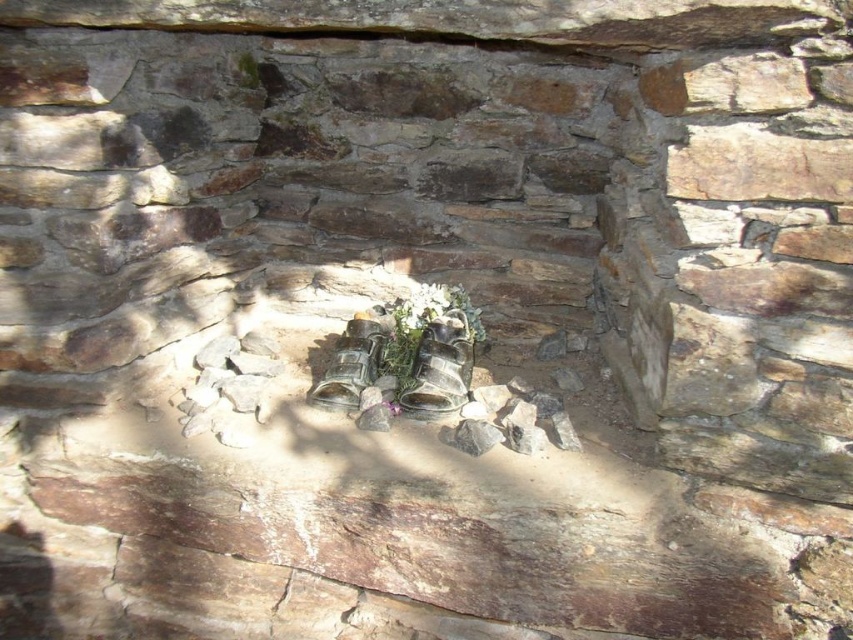
Looking at this image, you are an interior designer planning to place a small statue in the stone niche. The statue is 10 cm wide. The niche has a white matte floral arrangement at center and a white matte flower at center. Which object should you place the statue next to to ensure it fits comfortably?

The statue should be placed next to the white matte flower at center because it is smaller in size than the white matte floral arrangement at center, allowing more space for the statue.

You are an interior designer trying to place a decorative item in the stone niche. You have a small statue that is 2 inches wide. Can you fit it between the white matte floral arrangement at center and the white matte flowers at center?

The distance between the white matte floral arrangement at center and the white matte flowers at center is 1.90 inches. Since the statue is 2 inches wide, it cannot fit in the space between them.